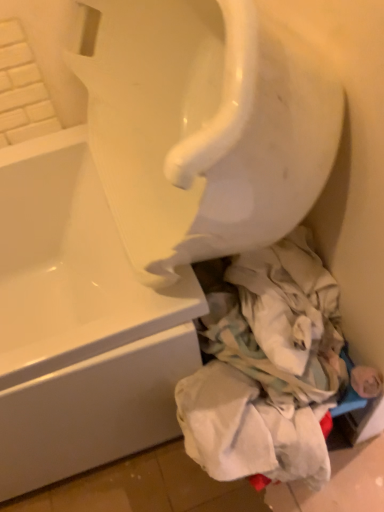
Describe the element at coordinates (79, 324) in the screenshot. I see `white glossy bathtub at lower left` at that location.

Image resolution: width=384 pixels, height=512 pixels. I want to click on white glossy bathtub at lower left, so click(79, 324).

The height and width of the screenshot is (512, 384). I want to click on white glossy bathtub at lower left, so click(x=79, y=324).